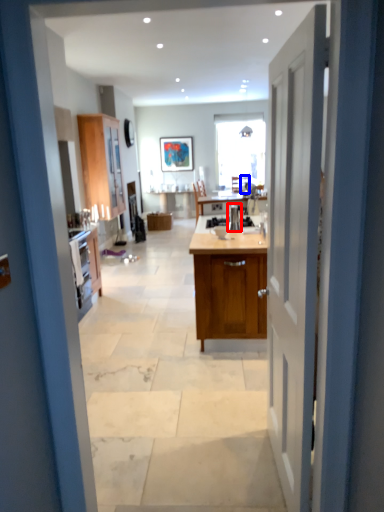
Question: Among these objects, which one is farthest to the camera, appliance (highlighted by a red box) or chair (highlighted by a blue box)?

Choices:
 (A) appliance
 (B) chair

Answer: (B)